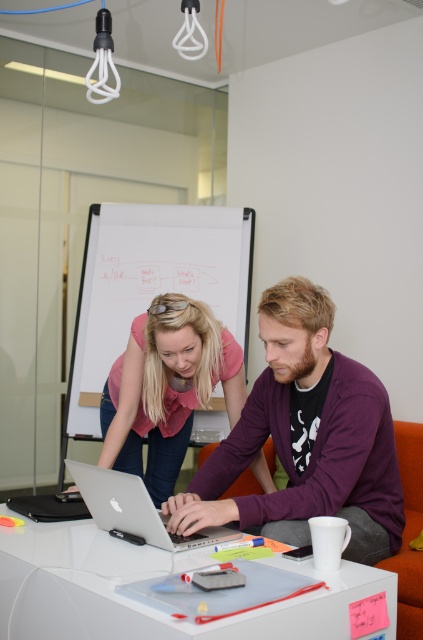
You are a person sitting at the table in the office scene. You want to reach for the silver metallic laptop at center to grab a USB drive from beside it. Can you easily reach it without moving the purple matte shirt at center?

The silver metallic laptop at center is behind the purple matte shirt at center, so you cannot easily reach it without moving the purple matte shirt at center first.

You are an office assistant who needs to determine which object at the center of the table is bigger. You see the purple matte shirt at center and the silver metallic laptop at center. Which one is bigger?

The purple matte shirt at center is larger in size than the silver metallic laptop at center.

You are a delivery person who needs to place a package on the white plastic table at center without disturbing the purple matte shirt at center. Which side of the table should you place the package?

The purple matte shirt at center is positioned on the right side of white plastic table at center, so you should place the package on the left side of the white plastic table at center to avoid disturbing it.